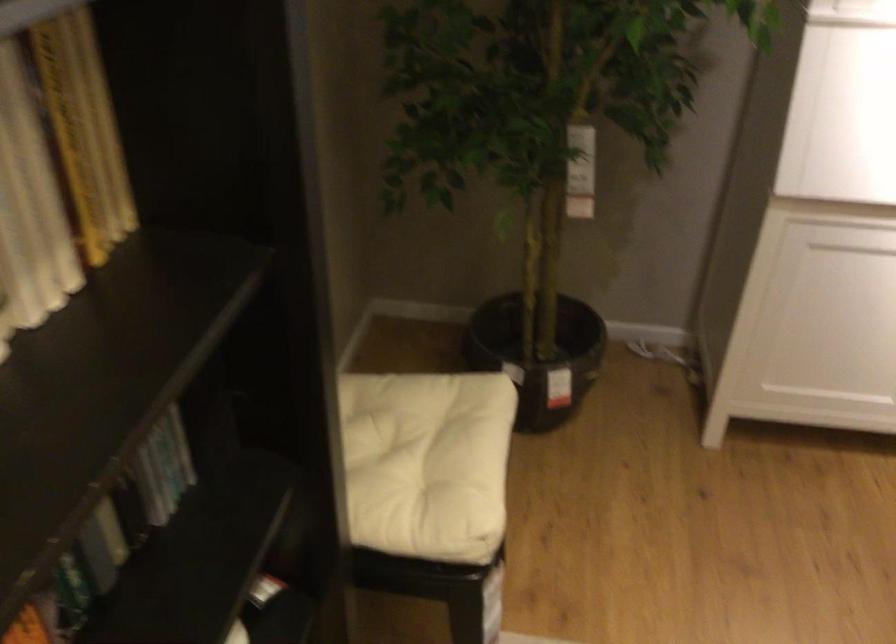
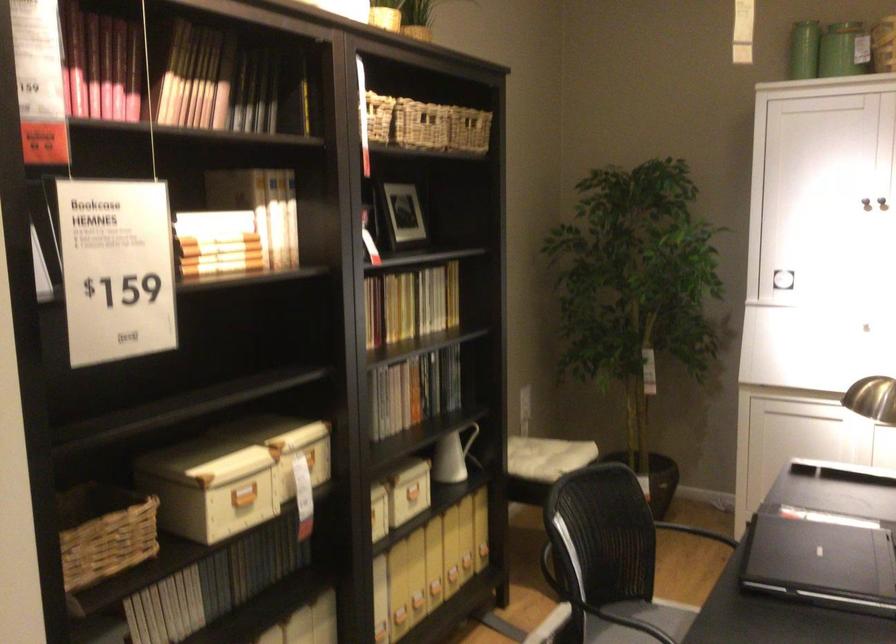
Where in the second image is the point corresponding to the point at 263,550 from the first image?

(474, 444)